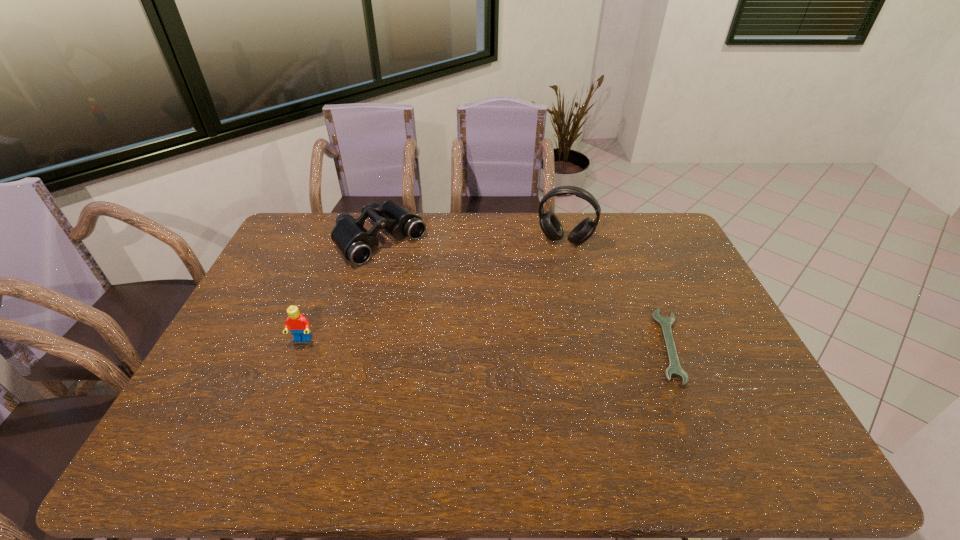
Locate an element on the screen. Image resolution: width=960 pixels, height=540 pixels. vacant point located between the Lego and the tallest object is located at coordinates click(x=434, y=291).

Find the location of a particular element. This screenshot has width=960, height=540. vacant space that's between the binoculars and the Lego is located at coordinates (342, 291).

Identify which object is located as the second nearest to the rightmost object. Please provide its 2D coordinates. Your answer should be formatted as a tuple, i.e. [(x, y)], where the tuple contains the x and y coordinates of a point satisfying the conditions above.

[(356, 243)]

This screenshot has height=540, width=960. Identify the location of object that stands as the closest to the tallest object. (674, 369).

You are a GUI agent. You are given a task and a screenshot of the screen. Output one action in this format:
    pyautogui.click(x=<x>, y=<y>)
    Task: Click on the free region that satisfies the following two spatial constraints: 1. on the front side of the third object from left to right; 2. on the left side of the binoculars
    The height and width of the screenshot is (540, 960).
    Given the screenshot: What is the action you would take?
    pyautogui.click(x=380, y=241)

Identify the location of vacant region that satisfies the following two spatial constraints: 1. on the front side of the binoculars; 2. on the right side of the rightmost object. The width and height of the screenshot is (960, 540). (350, 346).

At what (x,y) coordinates should I click in order to perform the action: click on free space that satisfies the following two spatial constraints: 1. on the front side of the third object from left to right; 2. on the right side of the rightmost object. Please return your answer as a coordinate pair (x, y). The width and height of the screenshot is (960, 540). Looking at the image, I should click on (590, 346).